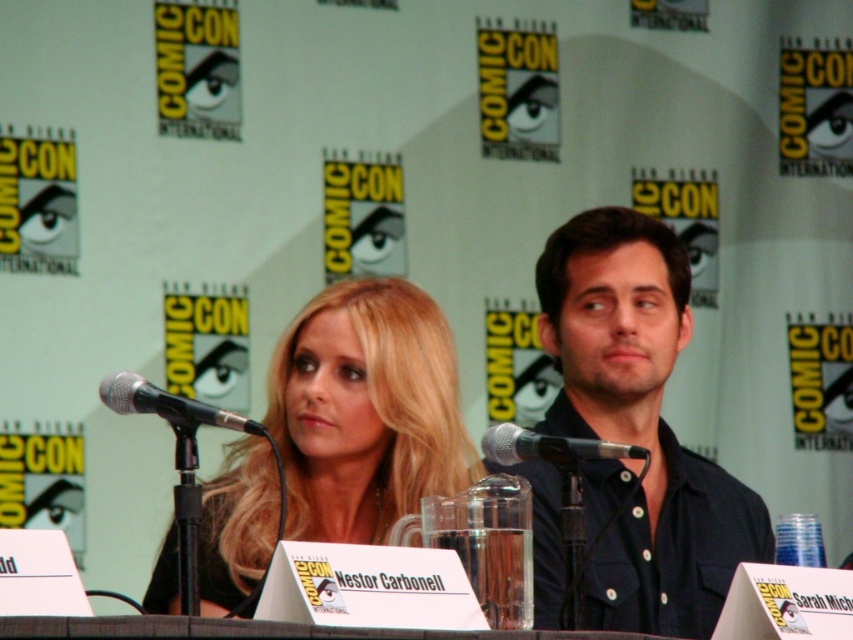
Does dark blue shirt at center have a larger size compared to black metallic microphone at center?

Yes.

Which is below, dark blue shirt at center or black metallic microphone at center?

dark blue shirt at center is below.

Is point (567, 317) more distant than point (579, 445)?

Yes.

You are a GUI agent. You are given a task and a screenshot of the screen. Output one action in this format:
    pyautogui.click(x=<x>, y=<y>)
    Task: Click on the dark blue shirt at center
    The image size is (853, 640).
    Given the screenshot: What is the action you would take?
    pyautogui.click(x=637, y=428)

Does transparent glass table at center come behind matte black microphone at center?

That is False.

Who is lower down, transparent glass table at center or matte black microphone at center?

transparent glass table at center is lower down.

You are a GUI agent. You are given a task and a screenshot of the screen. Output one action in this format:
    pyautogui.click(x=<x>, y=<y>)
    Task: Click on the transparent glass table at center
    Image resolution: width=853 pixels, height=640 pixels.
    Given the screenshot: What is the action you would take?
    pos(250,628)

Where is `transparent glass table at center`? The height and width of the screenshot is (640, 853). transparent glass table at center is located at coordinates (250, 628).

This screenshot has height=640, width=853. Describe the element at coordinates (364, 412) in the screenshot. I see `blonde hair at center` at that location.

Who is positioned more to the right, blonde hair at center or transparent glass table at center?

Positioned to the right is transparent glass table at center.

You are a GUI agent. You are given a task and a screenshot of the screen. Output one action in this format:
    pyautogui.click(x=<x>, y=<y>)
    Task: Click on the blonde hair at center
    
    Given the screenshot: What is the action you would take?
    pyautogui.click(x=364, y=412)